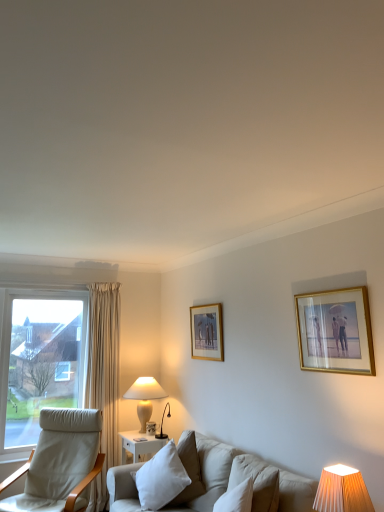
Question: Considering the relative sizes of light beige fabric chair at left and gold-framed picture at upper right, which appears as the first picture frame when viewed from the front, in the image provided, is light beige fabric chair at left bigger than gold-framed picture at upper right, which appears as the first picture frame when viewed from the front,?

Choices:
 (A) yes
 (B) no

Answer: (A)

Question: Does light beige fabric chair at left appear on the left side of gold-framed picture at upper right, which is the second picture frame from left to right?

Choices:
 (A) no
 (B) yes

Answer: (B)

Question: From a real-world perspective, is light beige fabric chair at left on gold-framed picture at upper right, which is the second picture frame from left to right?

Choices:
 (A) no
 (B) yes

Answer: (A)

Question: Is light beige fabric chair at left taller than gold-framed picture at upper right, which appears as the first picture frame when viewed from the front?

Choices:
 (A) yes
 (B) no

Answer: (A)

Question: Is light beige fabric chair at left closer to the viewer compared to gold-framed picture at upper right, which is the 1th picture frame from right to left?

Choices:
 (A) yes
 (B) no

Answer: (B)

Question: Could you tell me if light beige fabric chair at left is facing gold-framed picture at upper right, which is the second picture frame from left to right?

Choices:
 (A) no
 (B) yes

Answer: (A)

Question: From a real-world perspective, is white ceramic table lamp at lower left, placed as the 1th table lamp when sorted from left to right, on top of wooden picture frame at center, the first picture frame from the back?

Choices:
 (A) no
 (B) yes

Answer: (A)

Question: Is white ceramic table lamp at lower left, the 2th table lamp viewed from the front, bigger than wooden picture frame at center, which is the 1th picture frame from left to right?

Choices:
 (A) yes
 (B) no

Answer: (A)

Question: Is white ceramic table lamp at lower left, the first table lamp in the back-to-front sequence, closer to camera compared to wooden picture frame at center, placed as the second picture frame when sorted from front to back?

Choices:
 (A) yes
 (B) no

Answer: (B)

Question: Is white ceramic table lamp at lower left, the 2th table lamp when ordered from right to left, taller than wooden picture frame at center, the first picture frame from the back?

Choices:
 (A) no
 (B) yes

Answer: (A)

Question: Is white ceramic table lamp at lower left, the 2th table lamp when ordered from right to left, behind wooden picture frame at center, which is the 1th picture frame from left to right?

Choices:
 (A) no
 (B) yes

Answer: (B)

Question: From a real-world perspective, does white ceramic table lamp at lower left, placed as the 1th table lamp when sorted from left to right, sit lower than wooden picture frame at center, placed as the second picture frame when sorted from front to back?

Choices:
 (A) no
 (B) yes

Answer: (B)

Question: Is white ceramic table lamp at lower left, the first table lamp in the back-to-front sequence, located outside orange pleated fabric lampshade at lower right, which ranks as the 1th table lamp in front-to-back order?

Choices:
 (A) no
 (B) yes

Answer: (B)